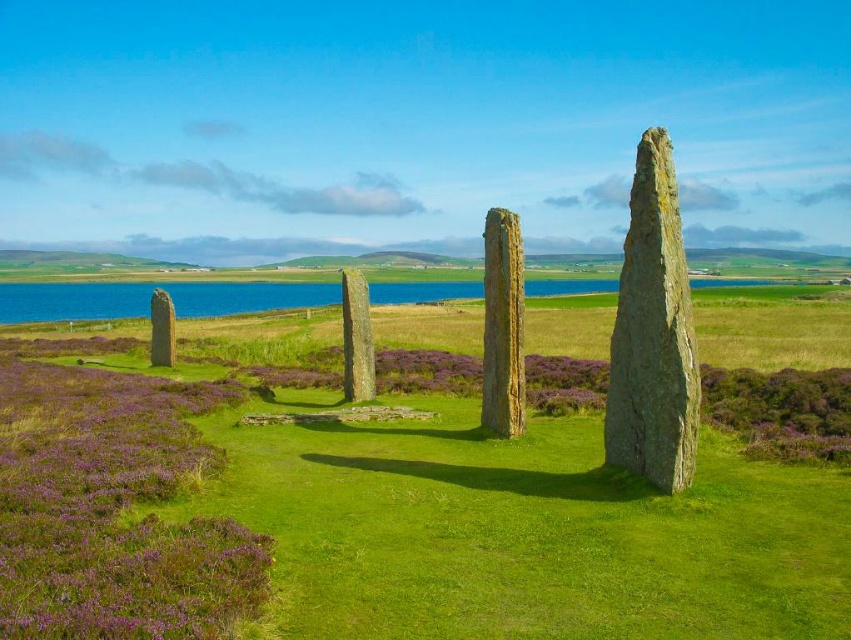
Question: Can you confirm if green grassy at center is positioned to the left of rusty stone pillar at center?

Choices:
 (A) yes
 (B) no

Answer: (A)

Question: Which point is closer to the camera taking this photo?

Choices:
 (A) (163, 292)
 (B) (370, 365)

Answer: (B)

Question: Can you confirm if green grassy at center is bigger than smooth stone monolith at center?

Choices:
 (A) yes
 (B) no

Answer: (A)

Question: Which object is positioned closest to the smooth stone monolith at center?

Choices:
 (A) rusty stone pillar at center
 (B) smooth gray stone at left
 (C) purple heather at left
 (D) smooth gray stone at center

Answer: (A)

Question: Which point is closer to the camera?

Choices:
 (A) purple heather at left
 (B) smooth gray stone at left
 (C) smooth stone monolith at center

Answer: (A)

Question: Does purple heather at left have a larger size compared to rusty stone pillar at center?

Choices:
 (A) yes
 (B) no

Answer: (A)